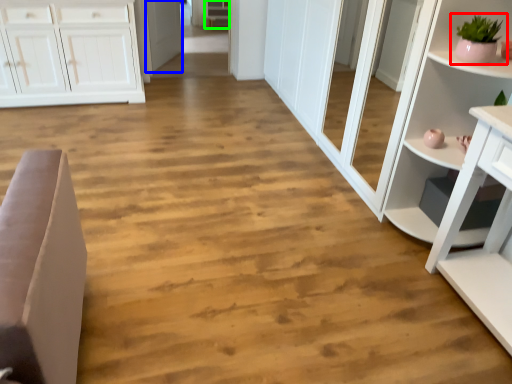
Question: Considering the real-world distances, which object is farthest from houseplant (highlighted by a red box)? door (highlighted by a blue box) or cabinetry (highlighted by a green box)?

Choices:
 (A) door
 (B) cabinetry

Answer: (B)